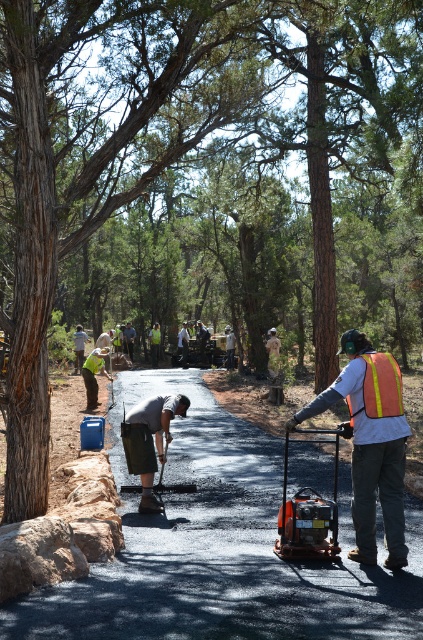
Question: Is dark gray concrete trowel at center below orange reflective safety vest at right?

Choices:
 (A) yes
 (B) no

Answer: (A)

Question: Does orange reflective vest at right have a larger size compared to orange reflective safety vest at right?

Choices:
 (A) yes
 (B) no

Answer: (A)

Question: Is orange metallic generator at center to the right of orange reflective safety vest at right from the viewer's perspective?

Choices:
 (A) no
 (B) yes

Answer: (A)

Question: Which point appears farthest from the camera in this image?

Choices:
 (A) (145, 464)
 (B) (310, 500)
 (C) (373, 456)
 (D) (398, 371)

Answer: (A)

Question: Among these objects, which one is farthest from the camera?

Choices:
 (A) dark gray concrete trowel at center
 (B) orange reflective vest at right

Answer: (A)

Question: Which object appears closest to the camera in this image?

Choices:
 (A) orange reflective vest at right
 (B) dark gray concrete trowel at center
 (C) orange metallic generator at center

Answer: (A)